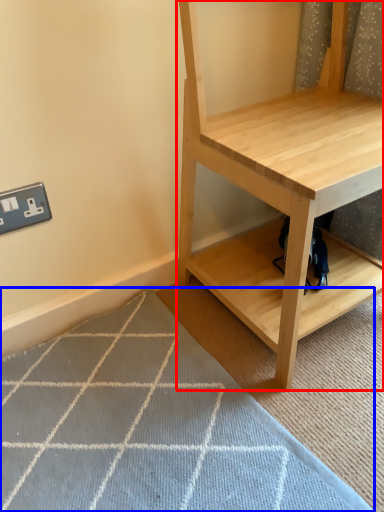
Question: Which of the following is the farthest to the observer, shelf (highlighted by a red box) or doormat (highlighted by a blue box)?

Choices:
 (A) shelf
 (B) doormat

Answer: (B)